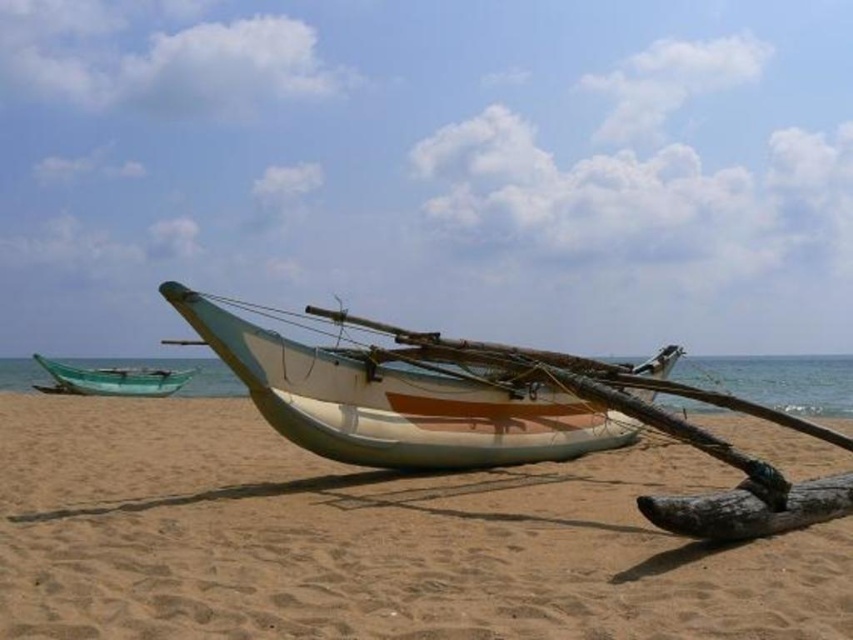
Does white matte boat at center come in front of brown wood log at lower right?

No, white matte boat at center is further to the viewer.

Measure the distance between white matte boat at center and camera.

A distance of 25.05 feet exists between white matte boat at center and camera.

Which is behind, point (566, 403) or point (785, 499)?

Point (566, 403)

The width and height of the screenshot is (853, 640). In order to click on white matte boat at center in this screenshot , I will do `click(393, 403)`.

Which is behind, point (398, 394) or point (74, 372)?

The point (74, 372) is behind.

Does white matte boat at center come in front of green plastic boat at left?

Yes, white matte boat at center is closer to the viewer.

Which is in front, point (541, 406) or point (57, 365)?

Point (541, 406) is more forward.

In order to click on white matte boat at center in this screenshot , I will do (393, 403).

Does sandy brown sand at center have a greater height compared to brown wood log at lower right?

No.

Which is in front, point (67, 428) or point (744, 502)?

Positioned in front is point (744, 502).

I want to click on sandy brown sand at center, so click(368, 540).